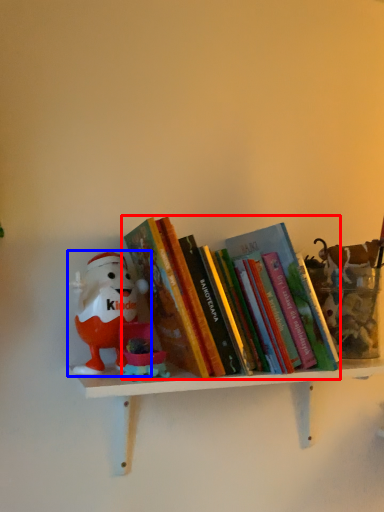
Question: Which object is closer to the camera taking this photo, book (highlighted by a red box) or toy (highlighted by a blue box)?

Choices:
 (A) book
 (B) toy

Answer: (A)